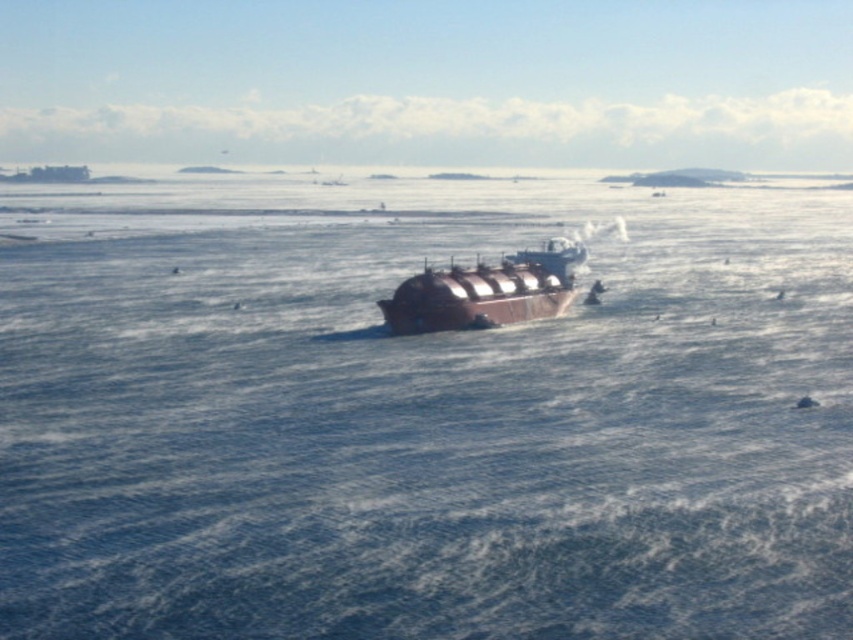
Which of these two, brown metallic water at center or brown matte tanker at center, stands taller?

Standing taller between the two is brown metallic water at center.

Can you confirm if brown metallic water at center is positioned below brown matte tanker at center?

No, brown metallic water at center is not below brown matte tanker at center.

In order to click on brown metallic water at center in this screenshot , I will do point(422,417).